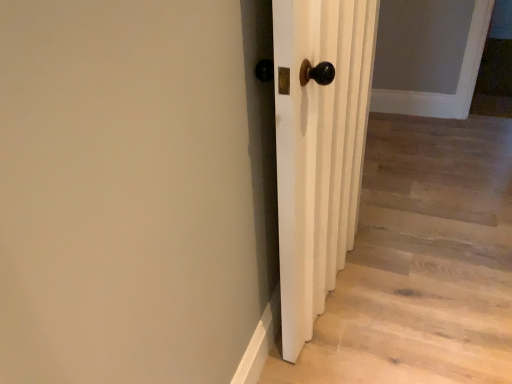
Question: Considering the relative sizes of white wooden door at center and white matte door at center in the image provided, is white wooden door at center wider than white matte door at center?

Choices:
 (A) no
 (B) yes

Answer: (A)

Question: Does white wooden door at center turn towards white matte door at center?

Choices:
 (A) yes
 (B) no

Answer: (B)

Question: From a real-world perspective, is white wooden door at center beneath white matte door at center?

Choices:
 (A) yes
 (B) no

Answer: (B)

Question: Is white matte door at center at the back of white wooden door at center?

Choices:
 (A) yes
 (B) no

Answer: (B)

Question: Is white wooden door at center to the left of white matte door at center from the viewer's perspective?

Choices:
 (A) yes
 (B) no

Answer: (A)

Question: Is white wooden door at center not within white matte door at center?

Choices:
 (A) yes
 (B) no

Answer: (A)

Question: From a real-world perspective, is white matte door at center over white wooden door at center?

Choices:
 (A) yes
 (B) no

Answer: (B)

Question: Is the depth of white matte door at center greater than that of white wooden door at center?

Choices:
 (A) no
 (B) yes

Answer: (B)

Question: Considering the relative positions of white matte door at center and white wooden door at center in the image provided, is white matte door at center to the right of white wooden door at center from the viewer's perspective?

Choices:
 (A) yes
 (B) no

Answer: (A)

Question: Does white matte door at center appear on the left side of white wooden door at center?

Choices:
 (A) no
 (B) yes

Answer: (A)

Question: Is the surface of white matte door at center in direct contact with white wooden door at center?

Choices:
 (A) yes
 (B) no

Answer: (B)

Question: Can you confirm if white matte door at center is wider than white wooden door at center?

Choices:
 (A) yes
 (B) no

Answer: (A)

Question: Is white wooden door at center taller or shorter than white matte door at center?

Choices:
 (A) tall
 (B) short

Answer: (A)